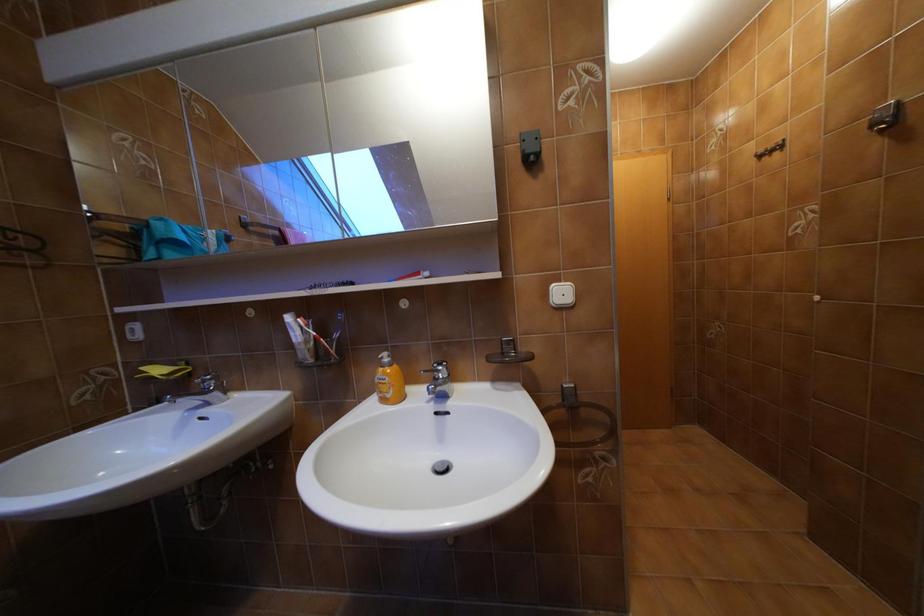
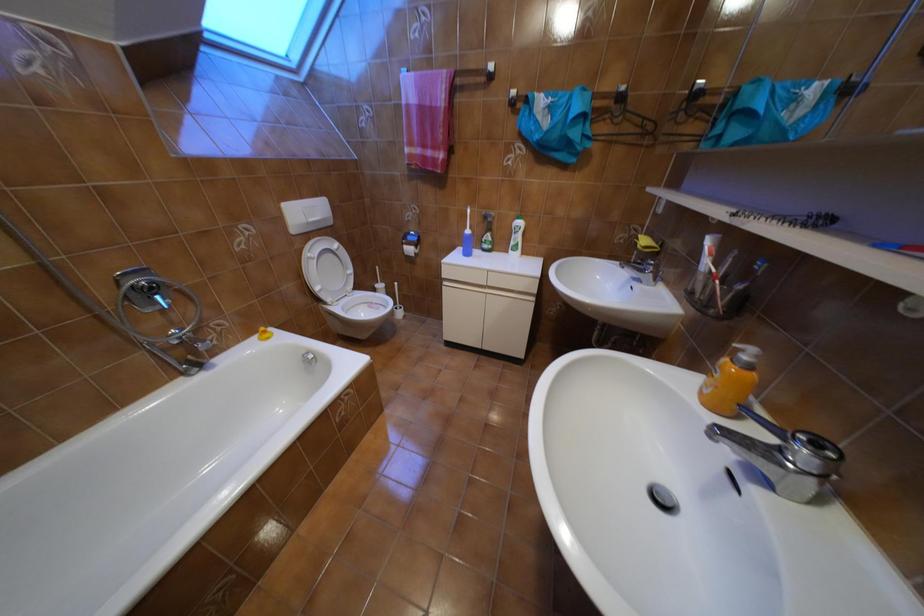
First-person continuous shooting, in which direction is the camera rotating?

The camera's rotation is toward left-down.